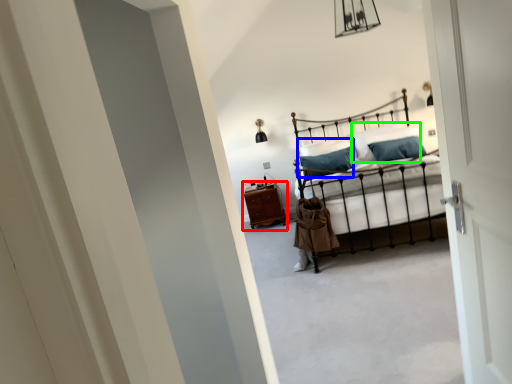
Question: Estimate the real-world distances between objects in this image. Which object is farther from nightstand (highlighted by a red box), pillow (highlighted by a blue box) or pillow (highlighted by a green box)?

Choices:
 (A) pillow
 (B) pillow

Answer: (B)